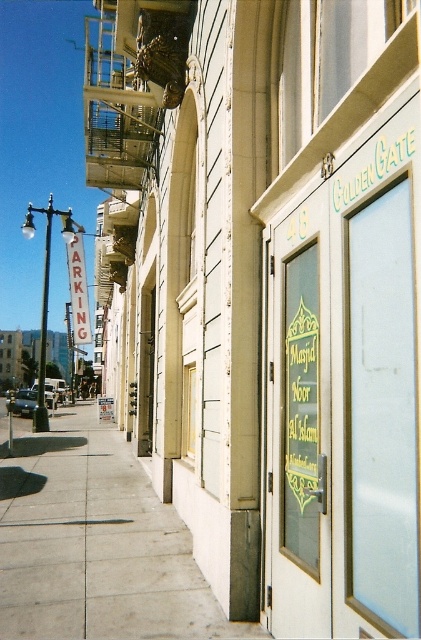
Question: Which object is closer to the camera taking this photo?

Choices:
 (A) translucent glass door at center
 (B) concrete sidewalk at lower left
 (C) green glass door at upper center

Answer: (C)

Question: Is the position of concrete sidewalk at lower left more distant than that of clear glass window at center?

Choices:
 (A) yes
 (B) no

Answer: (B)

Question: Observing the image, what is the correct spatial positioning of white plastic parking sign at left in reference to clear glass window at center?

Choices:
 (A) below
 (B) above

Answer: (B)

Question: Is concrete sidewalk at lower left wider than white plastic parking sign at left?

Choices:
 (A) no
 (B) yes

Answer: (B)

Question: Based on their relative distances, which object is nearer to the translucent glass door at center?

Choices:
 (A) white plastic parking sign at left
 (B) clear glass window at center
 (C) transparent glass door at center
 (D) green glass door at upper center

Answer: (C)

Question: Among these points, which one is nearest to the camera?

Choices:
 (A) (186, 381)
 (B) (293, 353)
 (C) (85, 307)
 (D) (402, 54)

Answer: (D)